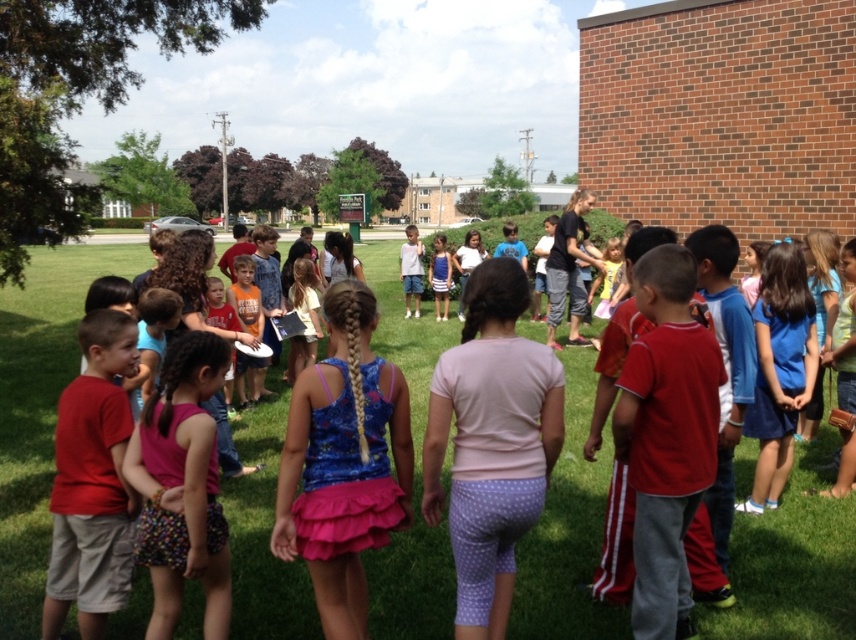
You are a photographer standing at the edge of the grassy area. You want to take a picture of the green grass at center and the blue striped dress at center. Which object will appear closer to the camera in the photo?

The green grass at center will appear closer to the camera because it is positioned in front of the blue striped dress at center in the image.

You are a photographer standing in front of the large brick building on the right. You want to take a photo that includes both the green grass at center and the blue printed tank top at center. Which object should you adjust your camera angle to focus on first to ensure both are in the frame?

The green grass at center is further to the viewer than the blue printed tank top at center, so you should focus on the green grass at center first to ensure both are in the frame.